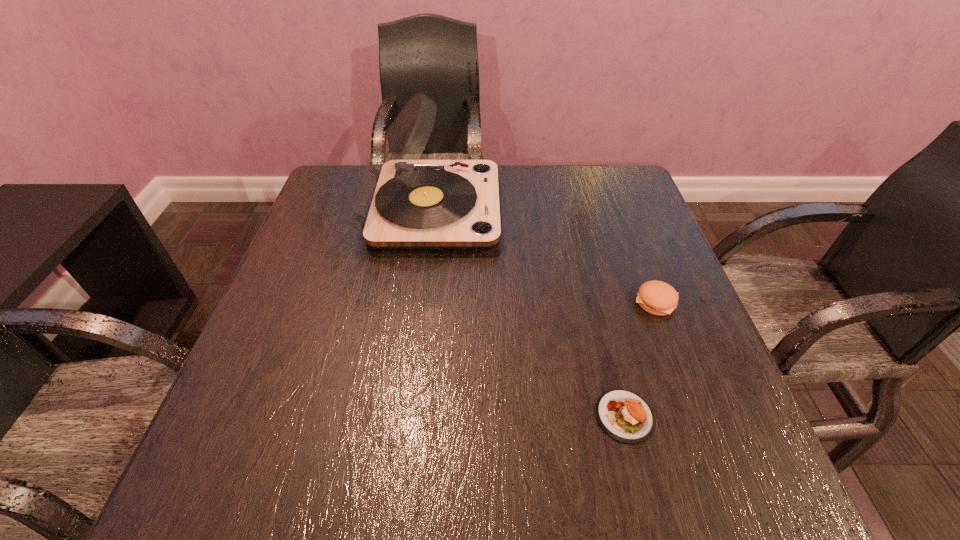
Where is `vacant area that lies between the shorter patty (food) and the record player`? The height and width of the screenshot is (540, 960). vacant area that lies between the shorter patty (food) and the record player is located at coordinates 528,313.

Locate an element on the screen. This screenshot has width=960, height=540. free space between the right patty (food) and the record player is located at coordinates (543, 255).

You are a GUI agent. You are given a task and a screenshot of the screen. Output one action in this format:
    pyautogui.click(x=<x>, y=<y>)
    Task: Click on the vacant space that's between the rightmost object and the shorter patty (food)
    This screenshot has height=540, width=960.
    Given the screenshot: What is the action you would take?
    pyautogui.click(x=640, y=359)

Where is `empty space that is in between the tallest object and the nearest object`? empty space that is in between the tallest object and the nearest object is located at coordinates (528, 313).

This screenshot has height=540, width=960. Find the location of `free space between the shorter patty (food) and the tallest object`. free space between the shorter patty (food) and the tallest object is located at coordinates point(528,313).

Image resolution: width=960 pixels, height=540 pixels. Identify the location of free spot between the tallest object and the nearest object. (528, 313).

Identify the location of free area in between the shorter patty (food) and the record player. This screenshot has width=960, height=540. (528, 313).

Where is `empty space between the nearest object and the farther patty (food)`? The width and height of the screenshot is (960, 540). empty space between the nearest object and the farther patty (food) is located at coordinates (640, 359).

The height and width of the screenshot is (540, 960). In order to click on object that is the second closest to the record player in this screenshot , I will do `click(625, 416)`.

The image size is (960, 540). I want to click on object that is the second closest to the nearer patty (food), so click(402, 202).